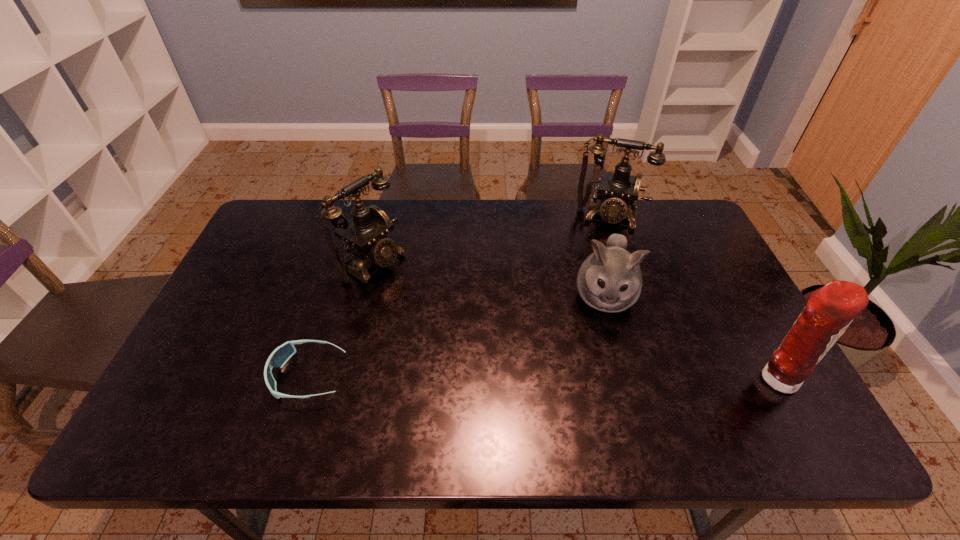
The image size is (960, 540). Find the location of `the shortest object`. the shortest object is located at coordinates (278, 358).

Identify the location of condiment. (829, 311).

Identify the location of the nearer telephone. The height and width of the screenshot is (540, 960). coord(365,235).

The width and height of the screenshot is (960, 540). In order to click on the farthest object in this screenshot , I will do `click(618, 190)`.

This screenshot has height=540, width=960. I want to click on the farther telephone, so click(618, 190).

The image size is (960, 540). Find the location of `hamster`. hamster is located at coordinates click(610, 280).

Locate an element on the screen. vacant space located 0.070m on the front-facing side of the shortest object is located at coordinates (244, 376).

The height and width of the screenshot is (540, 960). What are the coordinates of `free space located 0.230m on the front-facing side of the shortest object` in the screenshot? It's located at (178, 376).

Identify the location of free point located 0.110m on the left of the rightmost object. The height and width of the screenshot is (540, 960). point(705,379).

Find the location of a particular element. The height and width of the screenshot is (540, 960). vacant area situated 0.250m on the rotary dial of the nearer telephone is located at coordinates (462, 315).